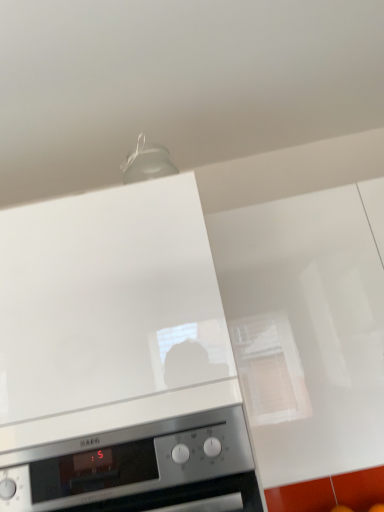
What do you see at coordinates (118, 358) in the screenshot? I see `white glossy range hood at upper center, which is the 1th home appliance from top to bottom` at bounding box center [118, 358].

In order to click on white glossy range hood at upper center, the second home appliance positioned from the bottom in this screenshot , I will do `click(118, 358)`.

Locate an element on the screen. The width and height of the screenshot is (384, 512). satin silver oven at lower center, which is the second home appliance from top to bottom is located at coordinates (135, 456).

Describe the element at coordinates (135, 456) in the screenshot. This screenshot has width=384, height=512. I see `satin silver oven at lower center, the 1th home appliance from the bottom` at that location.

Locate an element on the screen. Image resolution: width=384 pixels, height=512 pixels. white glossy range hood at upper center, which is the 1th home appliance from top to bottom is located at coordinates (118, 358).

Which is more to the left, white glossy range hood at upper center, which is the 1th home appliance from top to bottom, or satin silver oven at lower center, which is the second home appliance from top to bottom?

white glossy range hood at upper center, which is the 1th home appliance from top to bottom, is more to the left.

Is white glossy range hood at upper center, which is the 1th home appliance from top to bottom, further to the viewer compared to satin silver oven at lower center, which is the second home appliance from top to bottom?

Yes, it is.

Considering the points (230, 410) and (63, 453), which point is in front, point (230, 410) or point (63, 453)?

The point (230, 410) is closer.

From the image's perspective, is white glossy range hood at upper center, which is the 1th home appliance from top to bottom, located above satin silver oven at lower center, which is the second home appliance from top to bottom?

Yes, from the image's perspective, white glossy range hood at upper center, which is the 1th home appliance from top to bottom, is above satin silver oven at lower center, which is the second home appliance from top to bottom.

From a real-world perspective, which object rests below the other?

In real-world perspective, satin silver oven at lower center, which is the second home appliance from top to bottom, is lower.

Which object is wider, white glossy range hood at upper center, which is the 1th home appliance from top to bottom, or satin silver oven at lower center, the 1th home appliance from the bottom?

white glossy range hood at upper center, which is the 1th home appliance from top to bottom, is wider.

Between white glossy range hood at upper center, which is the 1th home appliance from top to bottom, and satin silver oven at lower center, which is the second home appliance from top to bottom, which one has less height?

satin silver oven at lower center, which is the second home appliance from top to bottom, is shorter.

Can you confirm if white glossy range hood at upper center, the second home appliance positioned from the bottom, is smaller than satin silver oven at lower center, the 1th home appliance from the bottom?

Incorrect, white glossy range hood at upper center, the second home appliance positioned from the bottom, is not smaller in size than satin silver oven at lower center, the 1th home appliance from the bottom.

Consider the image. Would you say white glossy range hood at upper center, which is the 1th home appliance from top to bottom, is outside satin silver oven at lower center, the 1th home appliance from the bottom?

Absolutely, white glossy range hood at upper center, which is the 1th home appliance from top to bottom, is external to satin silver oven at lower center, the 1th home appliance from the bottom.

Is white glossy range hood at upper center, which is the 1th home appliance from top to bottom, beside satin silver oven at lower center, the 1th home appliance from the bottom?

Yes, the surface of white glossy range hood at upper center, which is the 1th home appliance from top to bottom, is in contact with satin silver oven at lower center, the 1th home appliance from the bottom.

Consider the image. Is white glossy range hood at upper center, the second home appliance positioned from the bottom, looking in the opposite direction of satin silver oven at lower center, which is the second home appliance from top to bottom?

No.

How different are the orientations of white glossy range hood at upper center, the second home appliance positioned from the bottom, and satin silver oven at lower center, the 1th home appliance from the bottom, in degrees?

There is a 0.000215-degree angle between the facing directions of white glossy range hood at upper center, the second home appliance positioned from the bottom, and satin silver oven at lower center, the 1th home appliance from the bottom.

Where is `home appliance that is in front of the white glossy range hood at upper center, which is the 1th home appliance from top to bottom`? This screenshot has height=512, width=384. home appliance that is in front of the white glossy range hood at upper center, which is the 1th home appliance from top to bottom is located at coordinates (135, 456).

Which object is positioned more to the left, satin silver oven at lower center, the 1th home appliance from the bottom, or white glossy range hood at upper center, which is the 1th home appliance from top to bottom?

white glossy range hood at upper center, which is the 1th home appliance from top to bottom.

From the picture: Is the position of satin silver oven at lower center, the 1th home appliance from the bottom, more distant than that of white glossy range hood at upper center, the second home appliance positioned from the bottom?

No, satin silver oven at lower center, the 1th home appliance from the bottom, is in front of white glossy range hood at upper center, the second home appliance positioned from the bottom.

Considering the points (29, 482) and (25, 360), which point is in front, point (29, 482) or point (25, 360)?

The point (29, 482) is more forward.

From the image's perspective, between satin silver oven at lower center, which is the second home appliance from top to bottom, and white glossy range hood at upper center, the second home appliance positioned from the bottom, who is located below?

satin silver oven at lower center, which is the second home appliance from top to bottom.

From a real-world perspective, relative to white glossy range hood at upper center, which is the 1th home appliance from top to bottom, is satin silver oven at lower center, the 1th home appliance from the bottom, vertically above or below?

In terms of real-world spatial position, satin silver oven at lower center, the 1th home appliance from the bottom, is below white glossy range hood at upper center, which is the 1th home appliance from top to bottom.

Which of these two, satin silver oven at lower center, which is the second home appliance from top to bottom, or white glossy range hood at upper center, the second home appliance positioned from the bottom, is thinner?

satin silver oven at lower center, which is the second home appliance from top to bottom, is thinner.

Can you confirm if satin silver oven at lower center, which is the second home appliance from top to bottom, is shorter than white glossy range hood at upper center, which is the 1th home appliance from top to bottom?

Yes.

Considering the relative sizes of satin silver oven at lower center, which is the second home appliance from top to bottom, and white glossy range hood at upper center, which is the 1th home appliance from top to bottom, in the image provided, is satin silver oven at lower center, which is the second home appliance from top to bottom, bigger than white glossy range hood at upper center, which is the 1th home appliance from top to bottom,?

Incorrect, satin silver oven at lower center, which is the second home appliance from top to bottom, is not larger than white glossy range hood at upper center, which is the 1th home appliance from top to bottom.

Is satin silver oven at lower center, the 1th home appliance from the bottom, inside or outside of white glossy range hood at upper center, the second home appliance positioned from the bottom?

satin silver oven at lower center, the 1th home appliance from the bottom, is outside white glossy range hood at upper center, the second home appliance positioned from the bottom.

Is satin silver oven at lower center, which is the second home appliance from top to bottom, beside white glossy range hood at upper center, the second home appliance positioned from the bottom?

Absolutely, satin silver oven at lower center, which is the second home appliance from top to bottom, is next to and touching white glossy range hood at upper center, the second home appliance positioned from the bottom.

Is satin silver oven at lower center, which is the second home appliance from top to bottom, facing away from white glossy range hood at upper center, the second home appliance positioned from the bottom?

No, white glossy range hood at upper center, the second home appliance positioned from the bottom, is not at the back of satin silver oven at lower center, which is the second home appliance from top to bottom.

This screenshot has height=512, width=384. In order to click on home appliance behind the satin silver oven at lower center, the 1th home appliance from the bottom in this screenshot , I will do `click(118, 358)`.

This screenshot has width=384, height=512. Identify the location of home appliance above the satin silver oven at lower center, the 1th home appliance from the bottom (from the image's perspective). (118, 358).

The image size is (384, 512). In the image, there is a white glossy range hood at upper center, which is the 1th home appliance from top to bottom. In order to click on home appliance below it (from a real-world perspective) in this screenshot , I will do `click(135, 456)`.